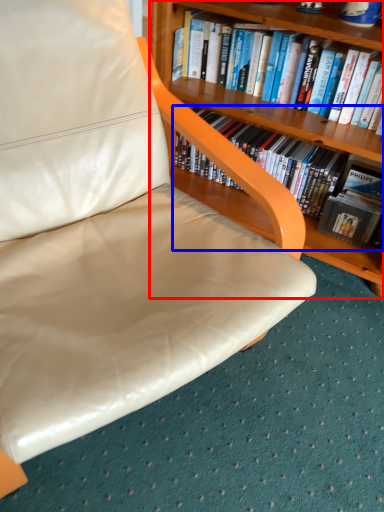
Question: Which object appears farthest to the camera in this image, bookcase (highlighted by a red box) or book (highlighted by a blue box)?

Choices:
 (A) bookcase
 (B) book

Answer: (B)